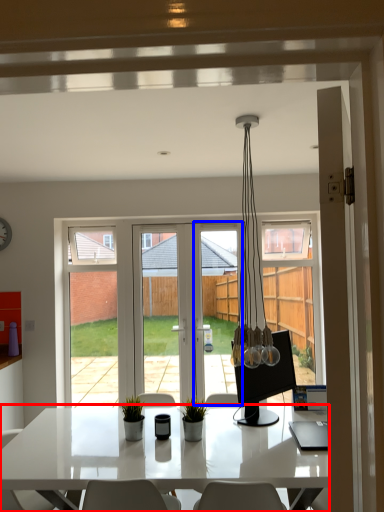
Question: Which of the following is the closest to the observer, desk (highlighted by a red box) or screen door (highlighted by a blue box)?

Choices:
 (A) desk
 (B) screen door

Answer: (A)